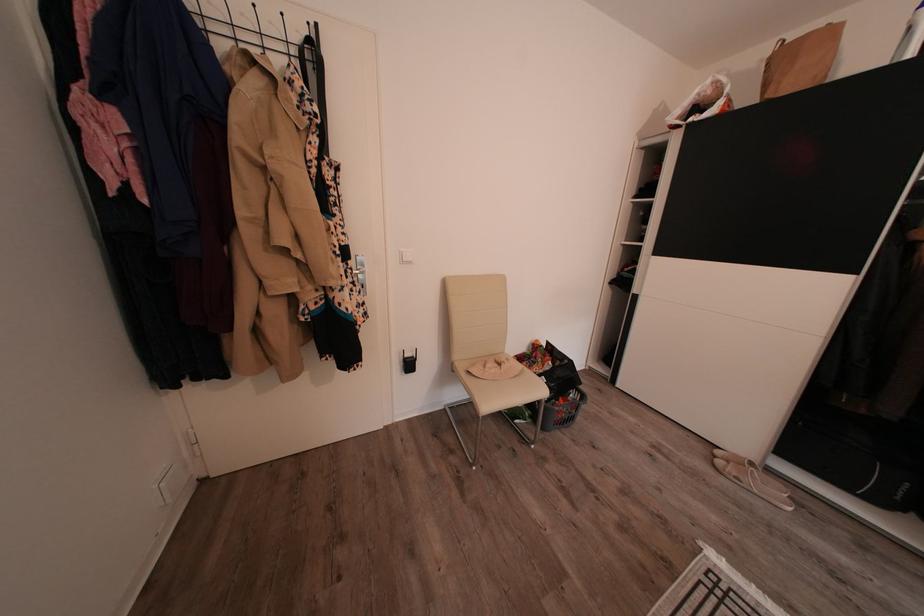
What do you see at coordinates (256, 13) in the screenshot? The image size is (924, 616). I see `the black coat hook` at bounding box center [256, 13].